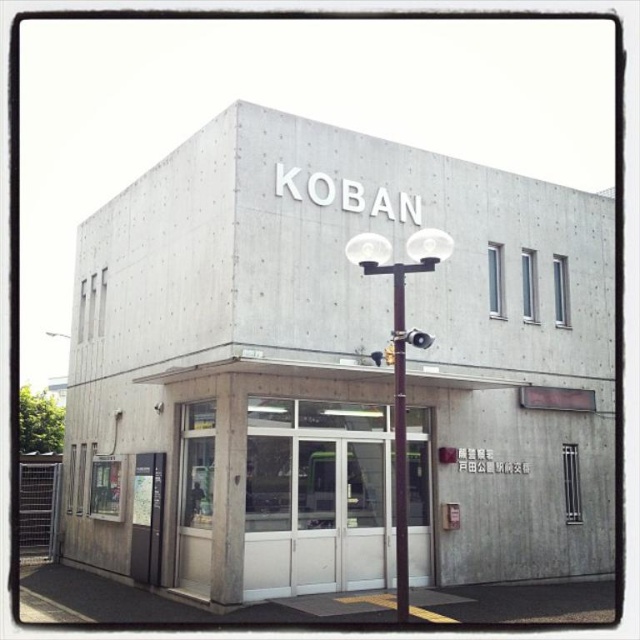
You are a delivery person carrying a package that requires a 3.0 meters wide space to maneuver. You are standing in front of the concrete building at center and need to move towards the smooth concrete sign at lower left. Is there enough space between them for you to move through?

The distance between the concrete building at center and the smooth concrete sign at lower left is 3.10 meters, which is wider than the required 3.0 meters, so you have enough space to maneuver your package through.

You are a delivery person approaching the building and need to find the entrance. Which object should you walk towards first, the concrete building at center or the smooth concrete sign at lower left?

You should walk towards the concrete building at center first because it is in front of the smooth concrete sign at lower left, making it closer to your current position.

You are a city planner analyzing the layout of this area. You need to determine the vertical relationship between the concrete building at center and the white concrete pole at center. Which one is positioned higher in the image?

The concrete building at center is positioned higher than the white concrete pole at center in the image.